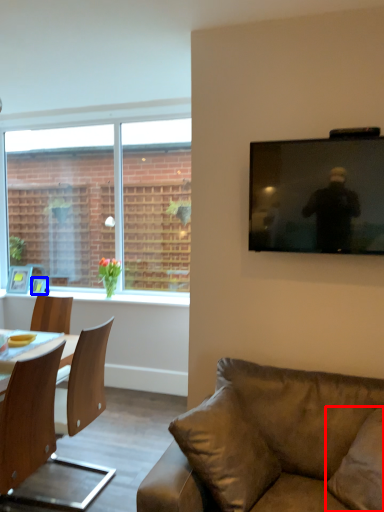
Question: Which object is closer to the camera taking this photo, pillow (highlighted by a red box) or picture frame (highlighted by a blue box)?

Choices:
 (A) pillow
 (B) picture frame

Answer: (A)